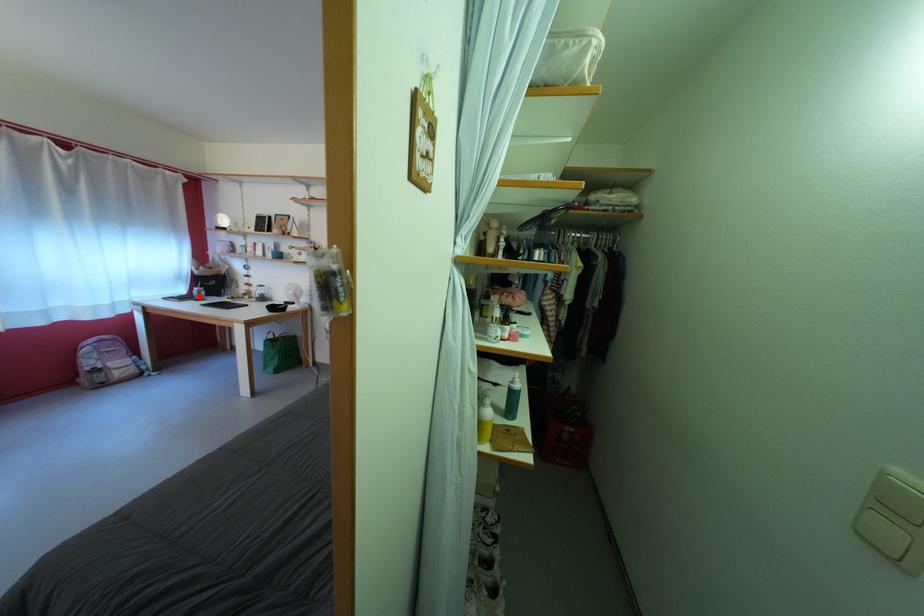
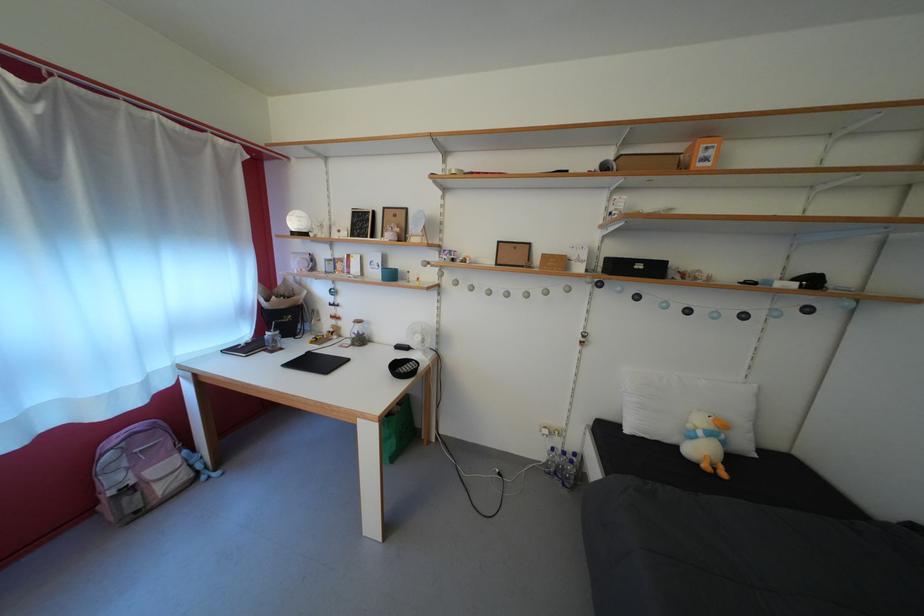
Find the pixel in the second image that matches the highlighted location in the first image.

(268, 339)